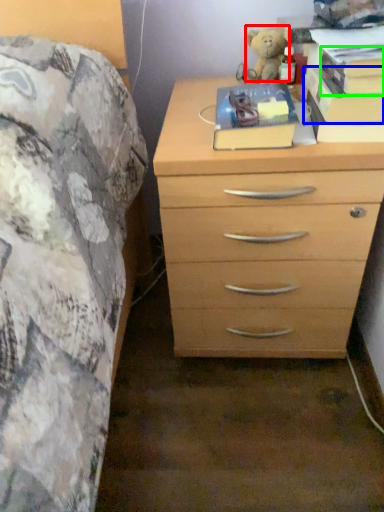
Question: Considering the real-world distances, which object is farthest from teddy (highlighted by a red box)? paperback book (highlighted by a blue box) or paperback book (highlighted by a green box)?

Choices:
 (A) paperback book
 (B) paperback book

Answer: (B)